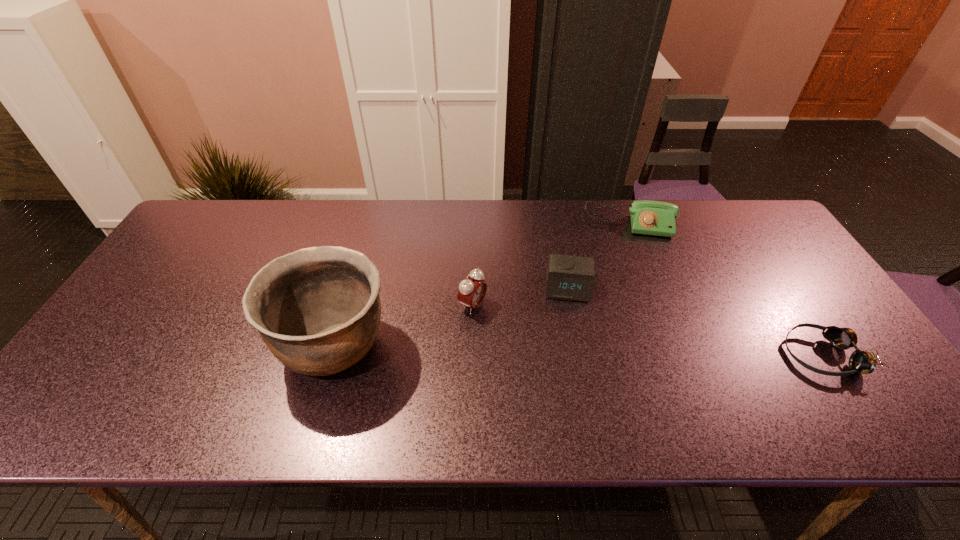
I want to click on the tallest object, so click(x=317, y=309).

The width and height of the screenshot is (960, 540). Identify the location of the leftmost object. (317, 309).

Locate an element on the screen. This screenshot has height=540, width=960. the shortest object is located at coordinates (864, 362).

I want to click on goggles, so click(x=864, y=362).

Where is `the fourth object from left to right`? the fourth object from left to right is located at coordinates click(x=648, y=217).

Find the location of a particular element. The width and height of the screenshot is (960, 540). telephone is located at coordinates (648, 217).

The height and width of the screenshot is (540, 960). In order to click on the second object from left to right in this screenshot , I will do `click(472, 290)`.

Locate an element on the screen. The height and width of the screenshot is (540, 960). the left alarm clock is located at coordinates (472, 290).

This screenshot has width=960, height=540. What are the coordinates of `the shorter alarm clock` in the screenshot? It's located at (569, 277).

Locate an element on the screen. The width and height of the screenshot is (960, 540). the third object from right to left is located at coordinates (569, 277).